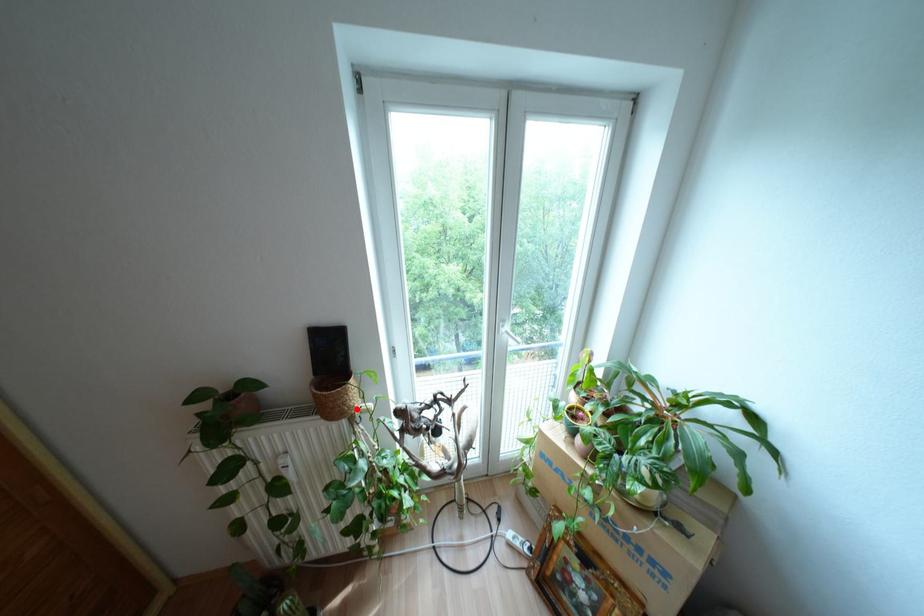
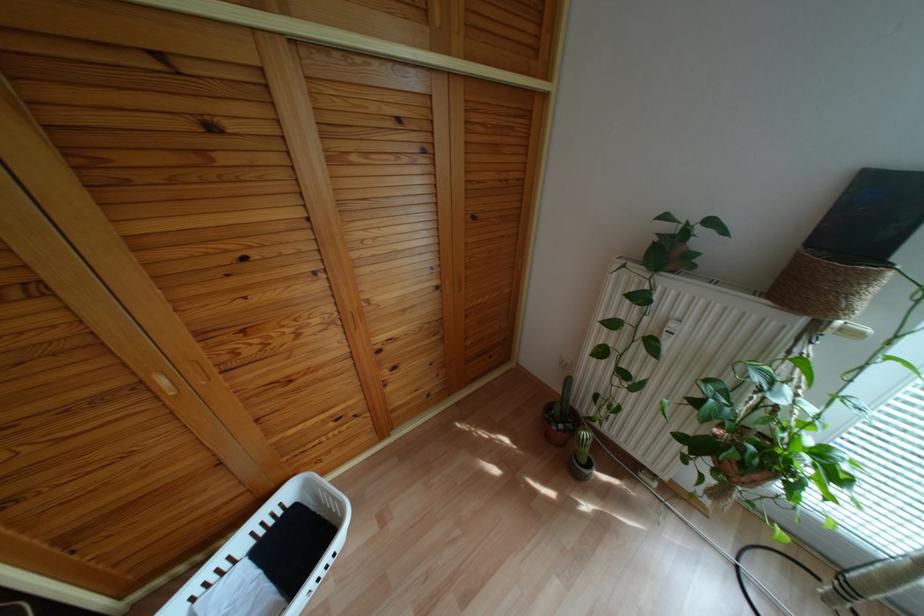
Find the pixel in the second image that matches the highlighted location in the first image.

(839, 322)